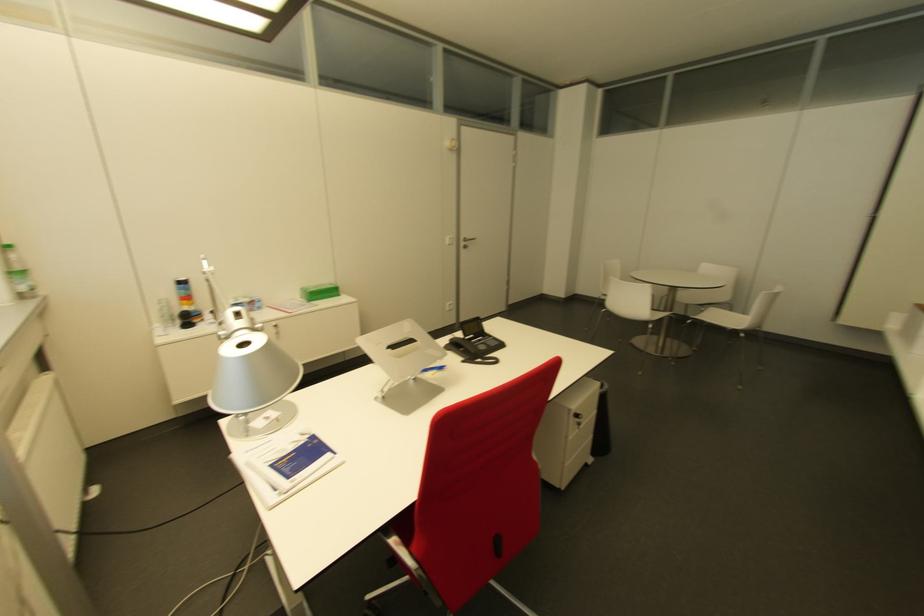
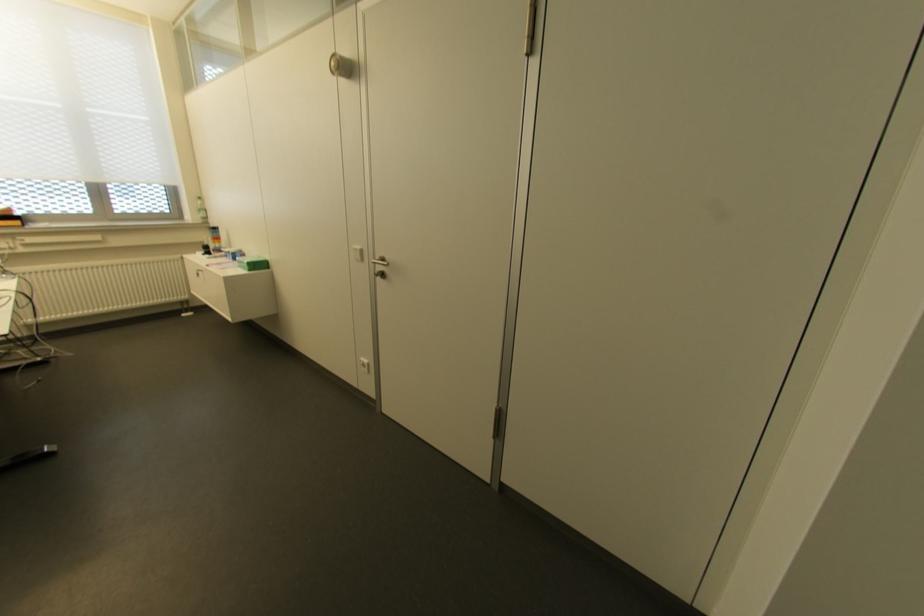
Locate, in the second image, the point that corresponds to point 448,237 in the first image.

(358, 246)